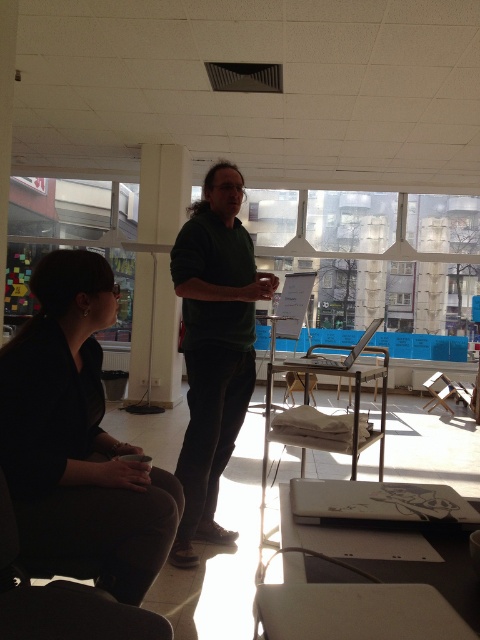
Who is higher up, dark brown fabric jacket at lower left or green matte shirt at center?

green matte shirt at center

Is point (70, 496) positioned behind point (196, 406)?

No, it is not.

Which is behind, point (24, 440) or point (191, 376)?

The point (191, 376) is more distant.

Where is `dark brown fabric jacket at lower left`? dark brown fabric jacket at lower left is located at coordinates (78, 436).

Between dark brown fabric jacket at lower left and black fabric chair at lower left, which one appears on the left side from the viewer's perspective?

dark brown fabric jacket at lower left

Describe the element at coordinates (78, 436) in the screenshot. I see `dark brown fabric jacket at lower left` at that location.

Identify the location of dark brown fabric jacket at lower left. Image resolution: width=480 pixels, height=640 pixels. (78, 436).

Is green matte shirt at center above black fabric chair at lower left?

Yes.

Between point (249, 369) and point (31, 632), which one is positioned in front?

Positioned in front is point (31, 632).

The width and height of the screenshot is (480, 640). I want to click on green matte shirt at center, so click(214, 348).